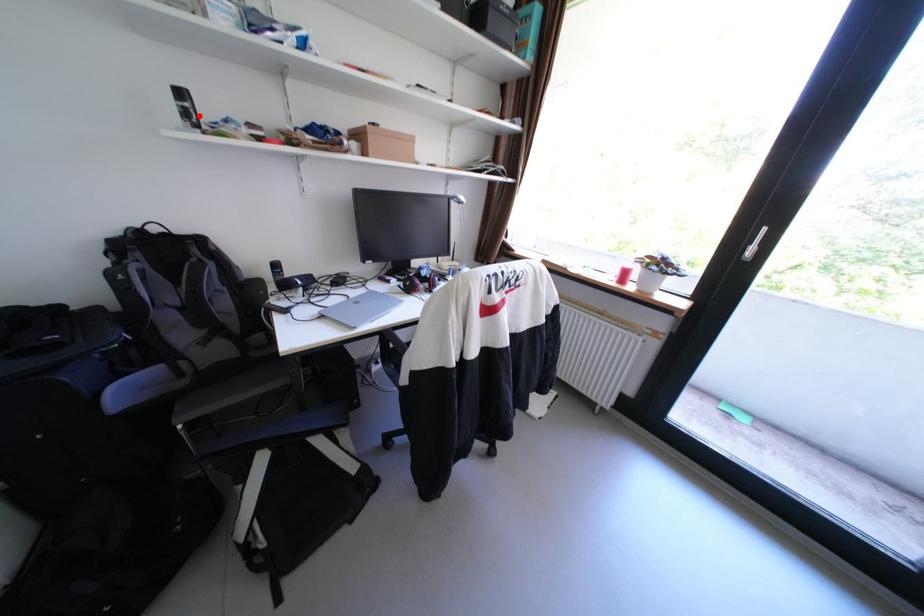
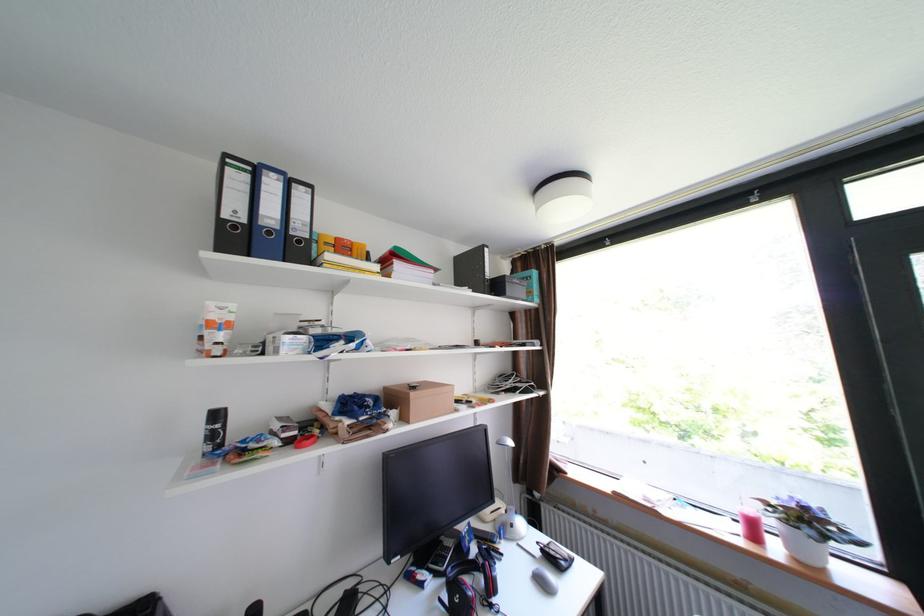
The point at the highlighted location is marked in the first image. Where is the corresponding point in the second image?

(225, 436)